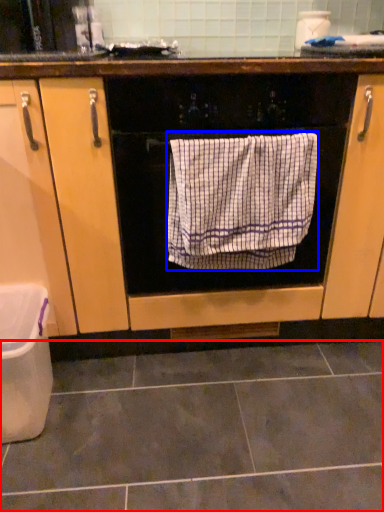
Question: Among these objects, which one is farthest to the camera, ceramic tile (highlighted by a red box) or bath towel (highlighted by a blue box)?

Choices:
 (A) ceramic tile
 (B) bath towel

Answer: (B)